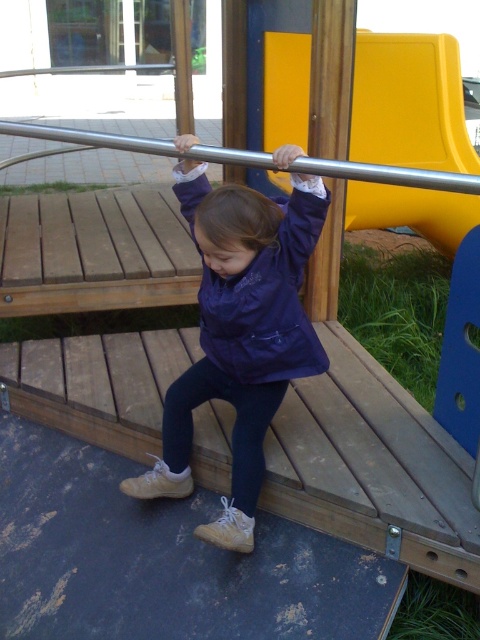
Question: Is navy blue fabric jacket at center to the right of wooden pole at center from the viewer's perspective?

Choices:
 (A) yes
 (B) no

Answer: (B)

Question: From the image, what is the correct spatial relationship of purple fabric jacket at center in relation to wooden pole at center?

Choices:
 (A) right
 (B) left

Answer: (B)

Question: Which is farther from the purple fabric jacket at center?

Choices:
 (A) yellow plastic slide at upper center
 (B) navy blue fabric jacket at center

Answer: (A)

Question: Which of the following is the farthest from the observer?

Choices:
 (A) (456, 44)
 (B) (264, 292)
 (C) (322, 269)
 (D) (260, 374)

Answer: (A)

Question: Is purple fabric jacket at center thinner than wooden pole at center?

Choices:
 (A) no
 (B) yes

Answer: (A)

Question: Which point is closer to the camera?

Choices:
 (A) yellow plastic slide at upper center
 (B) purple fabric jacket at center
 (C) wooden pole at center

Answer: (B)